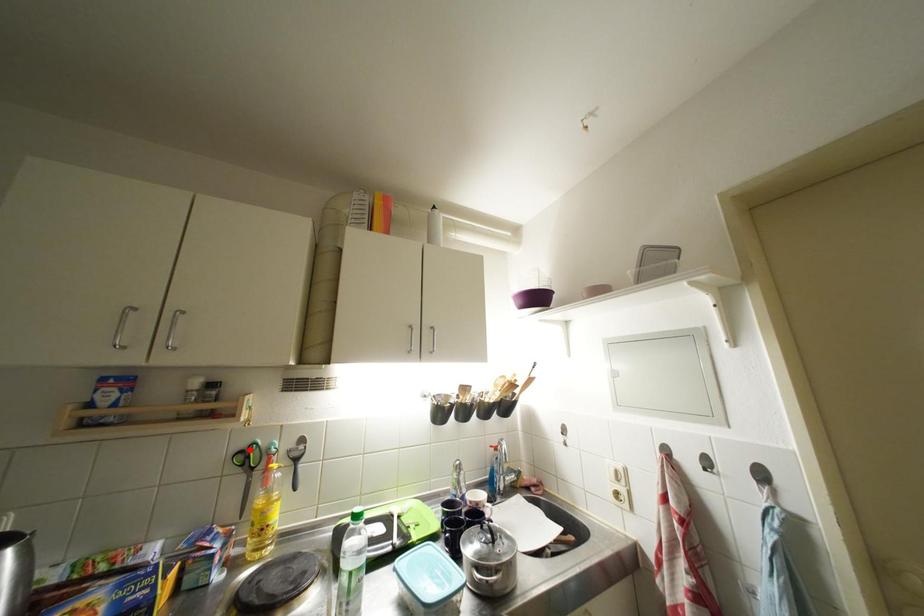
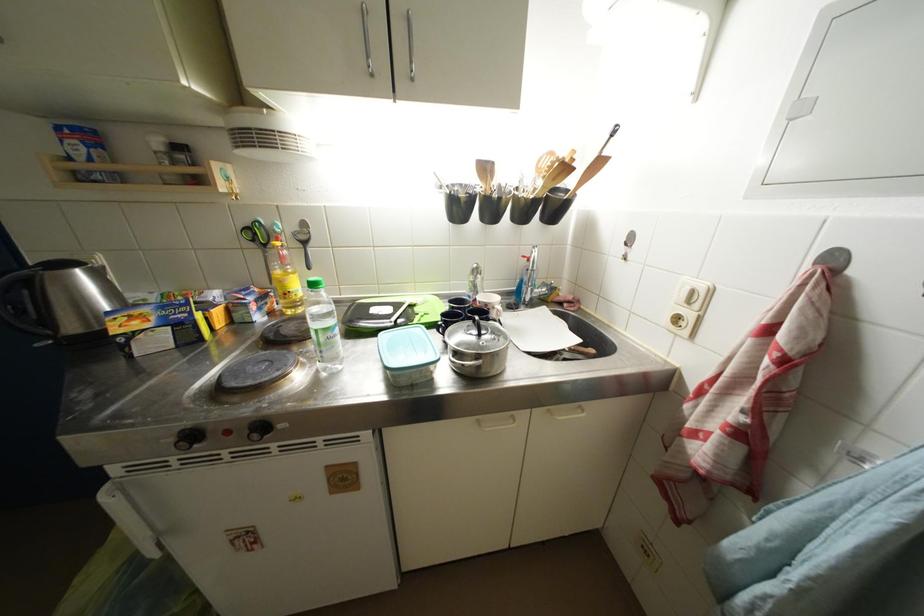
Find the pixel in the second image that matches the highlighted location in the first image.

(253, 227)